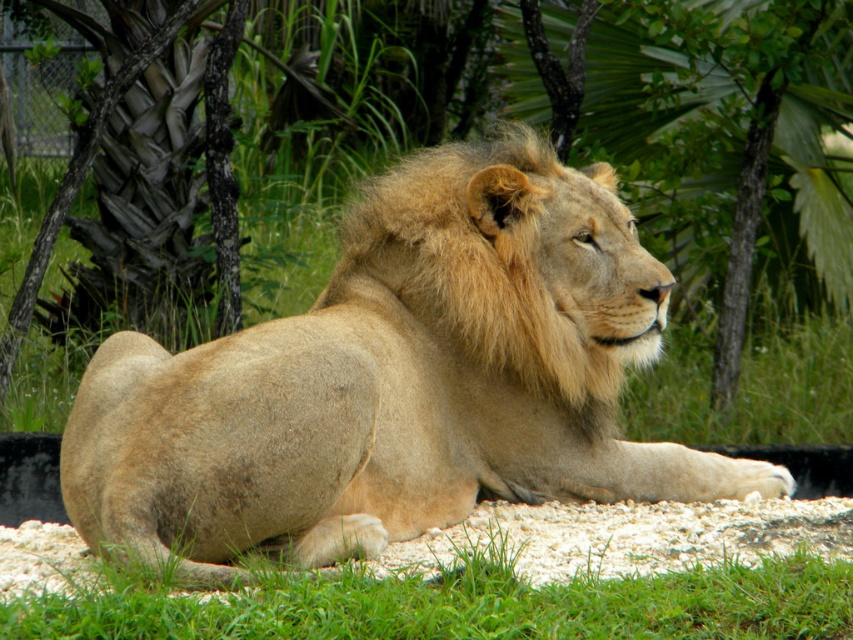
Question: Which point appears farthest from the camera in this image?

Choices:
 (A) (373, 419)
 (B) (796, 632)

Answer: (A)

Question: Can you confirm if golden fur lion at center is bigger than green grass at lower center?

Choices:
 (A) yes
 (B) no

Answer: (A)

Question: Does golden fur lion at center appear on the right side of green grass at lower center?

Choices:
 (A) no
 (B) yes

Answer: (B)

Question: Does golden fur lion at center appear under green grass at lower center?

Choices:
 (A) no
 (B) yes

Answer: (A)